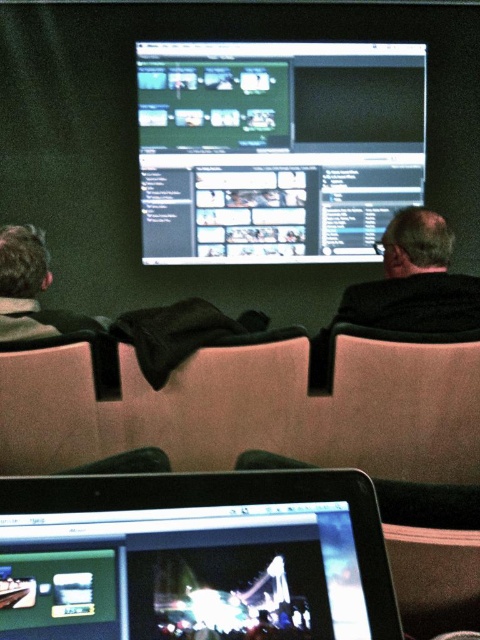
Question: Is matte black monitor at center bigger than gray woolen sweater at left?

Choices:
 (A) yes
 (B) no

Answer: (A)

Question: Which is farther from the gray woolen sweater at left?

Choices:
 (A) shiny silver laptop at lower center
 (B) matte black monitor at center

Answer: (B)

Question: Does shiny silver laptop at lower center appear on the left side of gray woolen sweater at left?

Choices:
 (A) no
 (B) yes

Answer: (A)

Question: Which of the following is the closest to the observer?

Choices:
 (A) matte black monitor at center
 (B) gray woolen sweater at left

Answer: (B)

Question: Which point is closer to the camera taking this photo?

Choices:
 (A) (24, 589)
 (B) (286, 116)

Answer: (A)

Question: Is matte black monitor at center above gray woolen sweater at left?

Choices:
 (A) yes
 (B) no

Answer: (A)